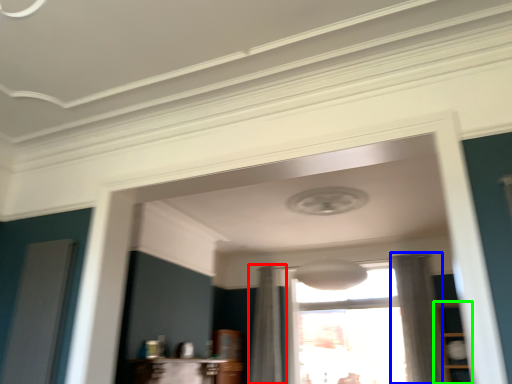
Question: Based on their relative distances, which object is farther from curtain (highlighted by a red box)? Choose from curtain (highlighted by a blue box) and cabinetry (highlighted by a green box).

Choices:
 (A) curtain
 (B) cabinetry

Answer: (B)